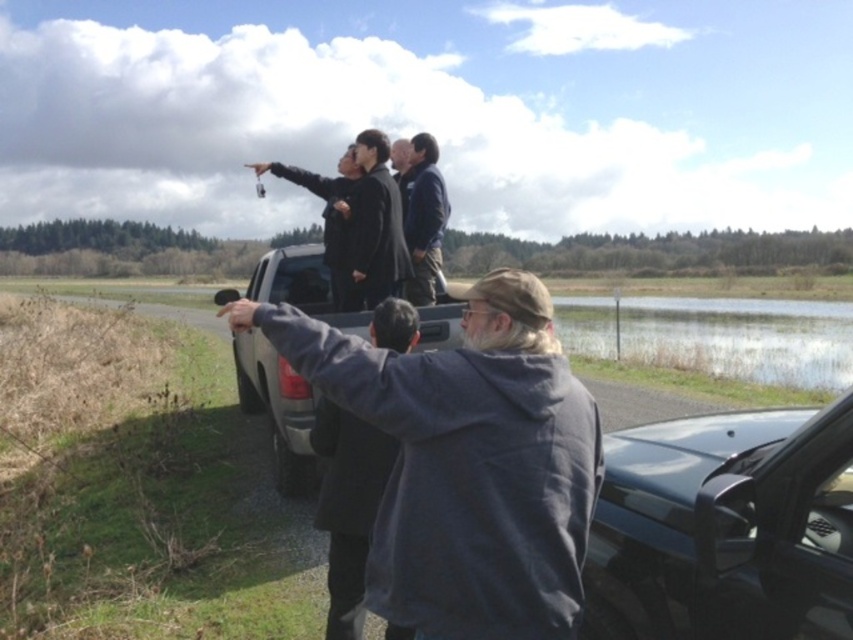
Question: Can you confirm if gray matte pickup truck at center is thinner than glossy black car at lower right?

Choices:
 (A) no
 (B) yes

Answer: (A)

Question: Does glossy black car at lower right lie behind dark gray hoodie at center?

Choices:
 (A) no
 (B) yes

Answer: (A)

Question: Is gray matte pickup truck at center in front of gray matte truck at center?

Choices:
 (A) no
 (B) yes

Answer: (B)

Question: Estimate the real-world distances between objects in this image. Which object is farther from the dark blue jacket at center?

Choices:
 (A) gray matte truck at center
 (B) dark gray jacket at center
 (C) dark gray hoodie at center
 (D) gray matte pickup truck at center

Answer: (D)

Question: Among these points, which one is farthest from the camera?

Choices:
 (A) (364, 154)
 (B) (393, 320)
 (C) (419, 225)

Answer: (C)

Question: Which of the following is the farthest from the observer?

Choices:
 (A) gray matte truck at center
 (B) glossy black car at lower right
 (C) dark blue jacket at center
 (D) dark gray hoodie at center

Answer: (C)